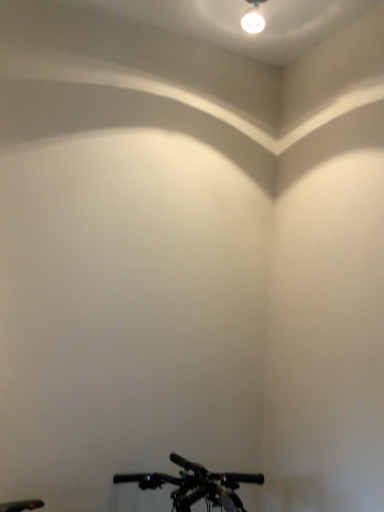
The image size is (384, 512). What are the coordinates of `white glossy light fixture at upper center` in the screenshot? It's located at (253, 18).

The image size is (384, 512). Describe the element at coordinates (253, 18) in the screenshot. I see `white glossy light fixture at upper center` at that location.

This screenshot has height=512, width=384. I want to click on white glossy light fixture at upper center, so click(253, 18).